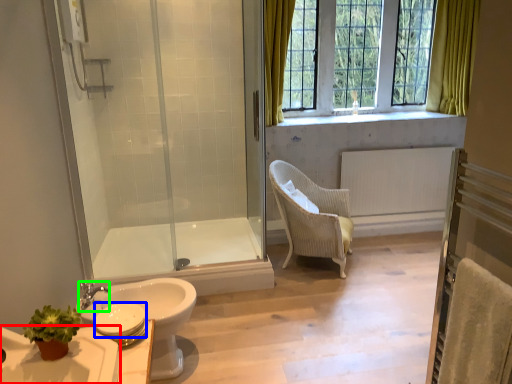
Question: Considering the real-world distances, which object is farthest from sink (highlighted by a red box)? toilet paper (highlighted by a blue box) or faucet (highlighted by a green box)?

Choices:
 (A) toilet paper
 (B) faucet

Answer: (B)